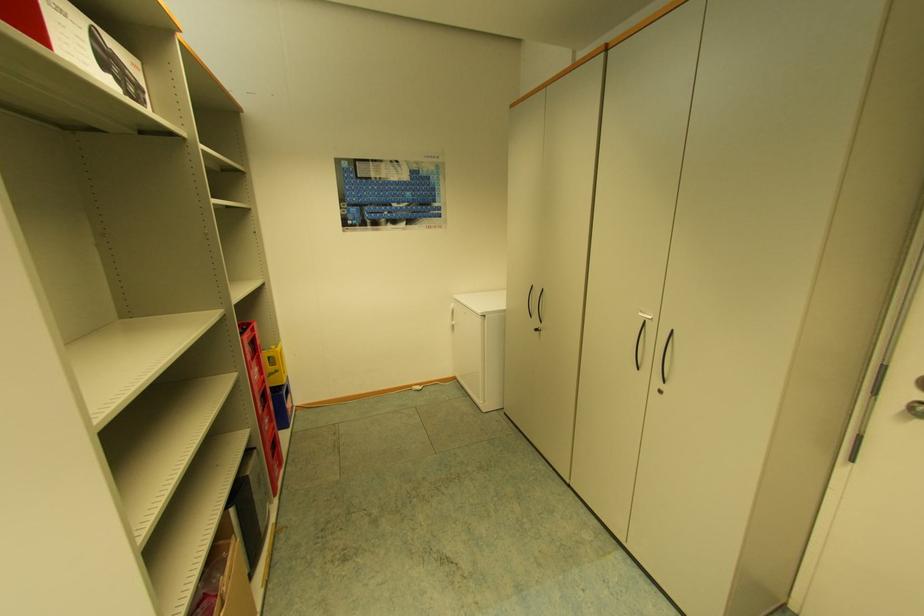
What do you see at coordinates (452, 320) in the screenshot? The image size is (924, 616). I see `the white fridge handle` at bounding box center [452, 320].